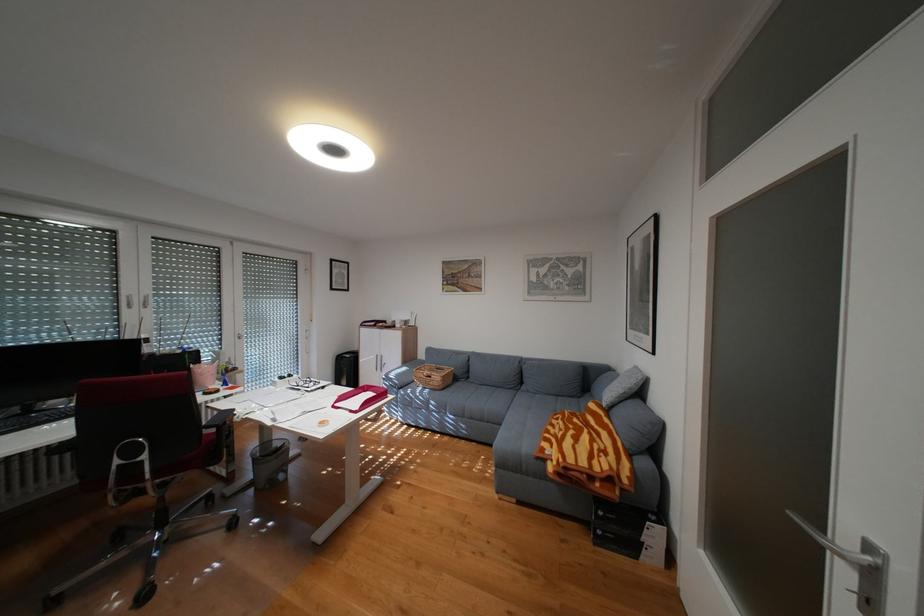
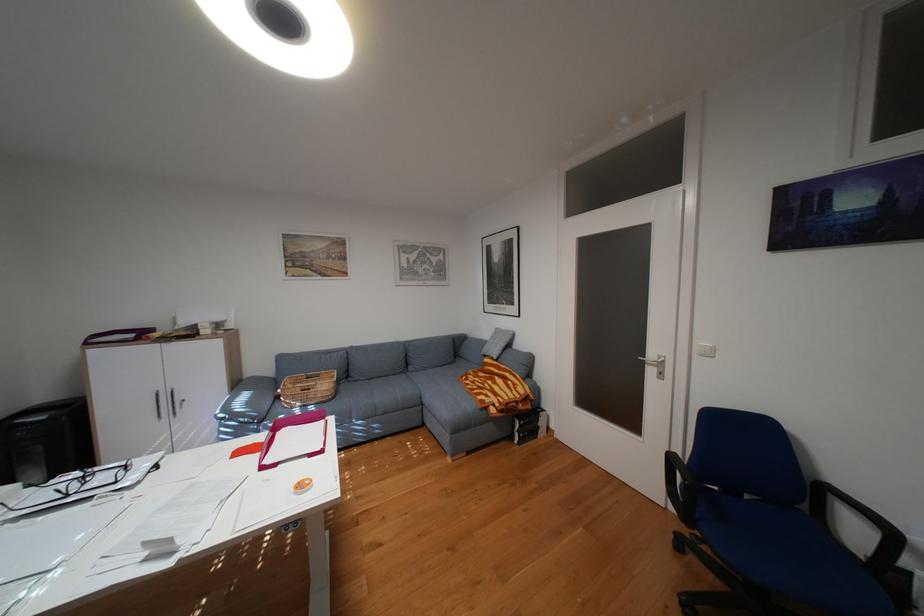
Where in the second image is the point corresponding to the point at 541,391 from the first image?

(430, 370)